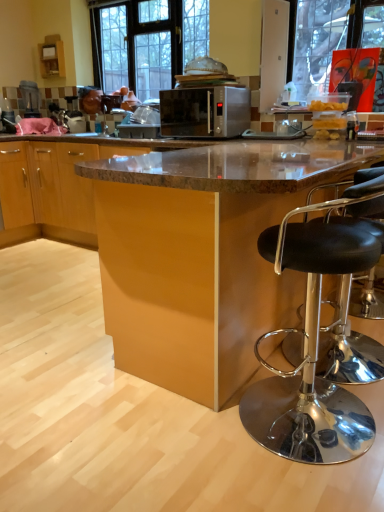
Question: Can we say black glass window at upper center lies outside black leather stool at right?

Choices:
 (A) yes
 (B) no

Answer: (A)

Question: From a real-world perspective, is black glass window at upper center physically above black leather stool at right?

Choices:
 (A) yes
 (B) no

Answer: (A)

Question: Does black glass window at upper center have a larger size compared to black leather stool at right?

Choices:
 (A) yes
 (B) no

Answer: (B)

Question: Considering the relative sizes of black glass window at upper center and black leather stool at right in the image provided, is black glass window at upper center thinner than black leather stool at right?

Choices:
 (A) yes
 (B) no

Answer: (A)

Question: Does black glass window at upper center appear on the right side of black leather stool at right?

Choices:
 (A) no
 (B) yes

Answer: (A)

Question: Considering the positions of brown glossy table at center and black glass window at upper center in the image, is brown glossy table at center taller or shorter than black glass window at upper center?

Choices:
 (A) tall
 (B) short

Answer: (B)

Question: Considering the positions of point (221, 386) and point (172, 41), is point (221, 386) closer or farther from the camera than point (172, 41)?

Choices:
 (A) closer
 (B) farther

Answer: (A)

Question: Considering the positions of brown glossy table at center and black glass window at upper center in the image, is brown glossy table at center wider or thinner than black glass window at upper center?

Choices:
 (A) wide
 (B) thin

Answer: (A)

Question: In terms of size, does brown glossy table at center appear bigger or smaller than black glass window at upper center?

Choices:
 (A) big
 (B) small

Answer: (A)

Question: Is brown glossy table at center in front of or behind satin silver microwave at center in the image?

Choices:
 (A) front
 (B) behind

Answer: (A)

Question: From the image's perspective, is brown glossy table at center above or below satin silver microwave at center?

Choices:
 (A) below
 (B) above

Answer: (A)

Question: Based on their sizes in the image, would you say brown glossy table at center is bigger or smaller than satin silver microwave at center?

Choices:
 (A) big
 (B) small

Answer: (A)

Question: Looking at their shapes, would you say brown glossy table at center is wider or thinner than satin silver microwave at center?

Choices:
 (A) thin
 (B) wide

Answer: (B)

Question: From their relative heights in the image, would you say brown glossy table at center is taller or shorter than black leather stool at right?

Choices:
 (A) tall
 (B) short

Answer: (A)

Question: From the image's perspective, relative to black leather stool at right, is brown glossy table at center above or below?

Choices:
 (A) above
 (B) below

Answer: (A)